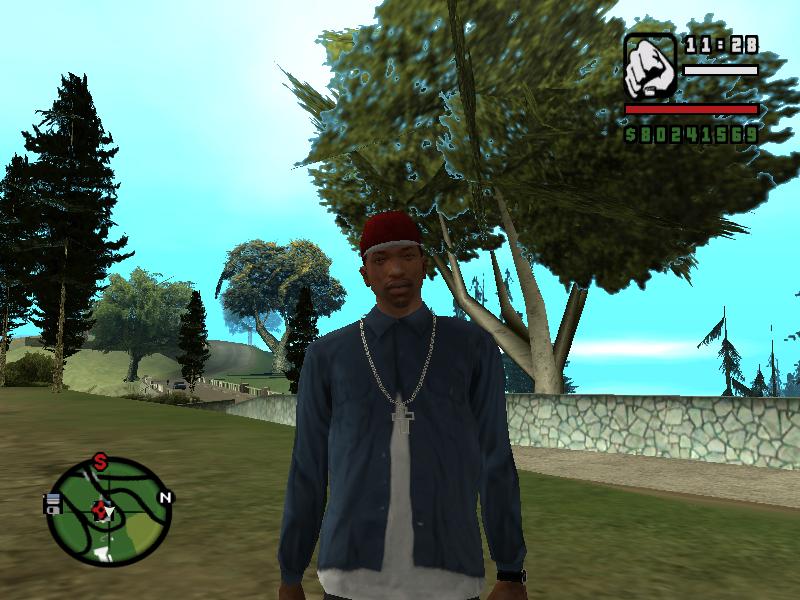
Identify the location of wall. Image resolution: width=800 pixels, height=600 pixels. (700, 416).